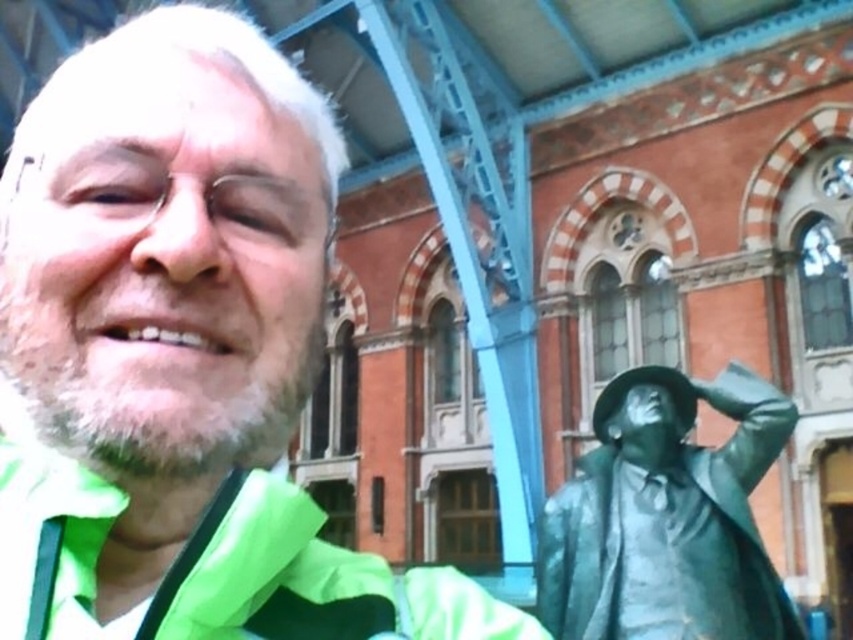
Based on the photo, is green matte jacket at left in front of bronze statue at right?

That is True.

Is green matte jacket at left bigger than bronze statue at right?

Yes.

This screenshot has height=640, width=853. Describe the element at coordinates (180, 352) in the screenshot. I see `green matte jacket at left` at that location.

At what (x,y) coordinates should I click in order to perform the action: click on green matte jacket at left. Please return your answer as a coordinate pair (x, y). The height and width of the screenshot is (640, 853). Looking at the image, I should click on pyautogui.click(x=180, y=352).

Who is taller, green fabric jacket at left or bronze statue at right?

Standing taller between the two is bronze statue at right.

Between green fabric jacket at left and bronze statue at right, which one appears on the left side from the viewer's perspective?

green fabric jacket at left is more to the left.

Describe the element at coordinates (221, 566) in the screenshot. I see `green fabric jacket at left` at that location.

Identify the location of green fabric jacket at left. (221, 566).

Which is more to the right, green matte jacket at left or green fabric jacket at left?

green fabric jacket at left

Which is behind, point (316, 147) or point (332, 608)?

Point (316, 147)

Identify the location of green matte jacket at left. Image resolution: width=853 pixels, height=640 pixels. (180, 352).

Locate an element on the screen. The image size is (853, 640). green matte jacket at left is located at coordinates (180, 352).